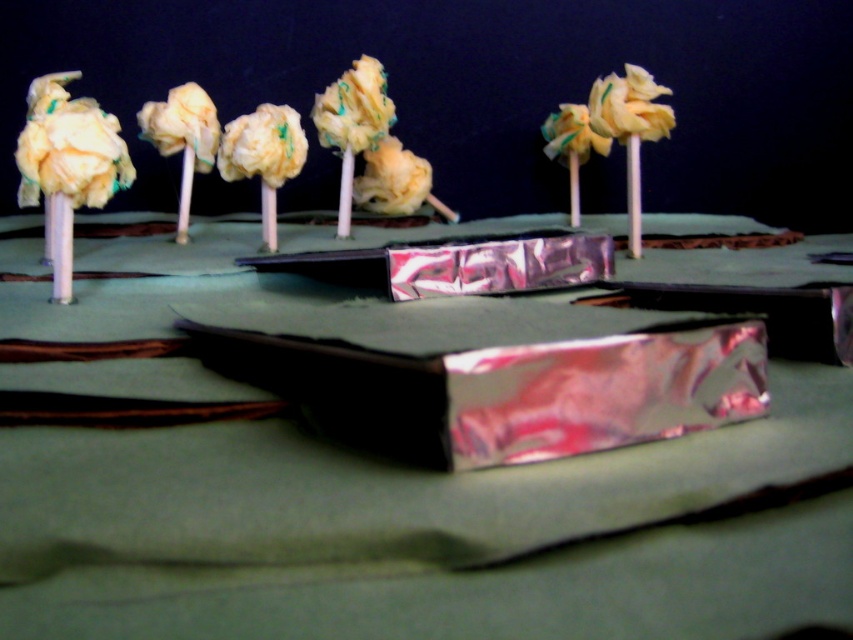
Between fluffy yellow fabric at center and yellow fabric flower at upper center, which one has more height?

With more height is fluffy yellow fabric at center.

Can you confirm if fluffy yellow fabric at center is bigger than yellow fabric flower at upper center?

Yes.

Locate an element on the screen. The width and height of the screenshot is (853, 640). fluffy yellow fabric at center is located at coordinates (354, 108).

Between metallic silver table at center and matte yellow fabric flower at center, which one is positioned lower?

Positioned lower is metallic silver table at center.

Who is more forward, (780,596) or (405,180)?

Point (780,596) is in front.

Is point (468, 339) positioned in front of point (378, 157)?

That is True.

Locate an element on the screen. metallic silver table at center is located at coordinates (379, 484).

Who is more distant from viewer, (238, 144) or (335, 138)?

Positioned behind is point (335, 138).

Who is more distant from viewer, (x=274, y=109) or (x=328, y=140)?

Point (x=328, y=140)

Image resolution: width=853 pixels, height=640 pixels. Identify the location of white fluffy flower at center. (262, 145).